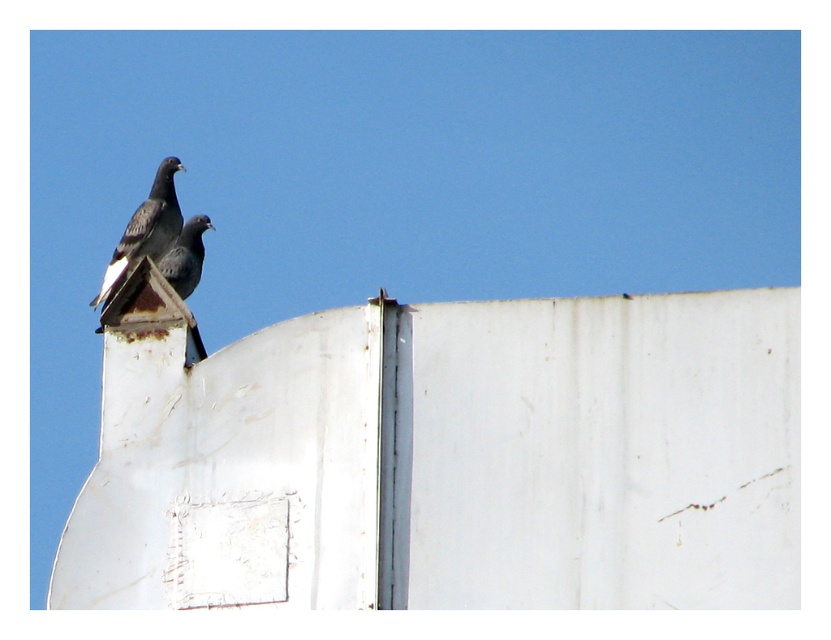
Question: Is dark gray matte pigeon at upper left closer to camera compared to matte black pigeon at center?

Choices:
 (A) yes
 (B) no

Answer: (B)

Question: Is dark gray matte pigeon at upper left positioned at the back of matte black pigeon at center?

Choices:
 (A) no
 (B) yes

Answer: (B)

Question: Is dark gray matte pigeon at upper left above matte black pigeon at center?

Choices:
 (A) yes
 (B) no

Answer: (A)

Question: Among these objects, which one is nearest to the camera?

Choices:
 (A) dark gray matte pigeon at upper left
 (B) matte black pigeon at center

Answer: (B)

Question: Among these objects, which one is nearest to the camera?

Choices:
 (A) dark gray matte pigeon at upper left
 (B) matte black pigeon at center

Answer: (B)

Question: Which object appears farthest from the camera in this image?

Choices:
 (A) dark gray matte pigeon at upper left
 (B) matte black pigeon at center

Answer: (A)